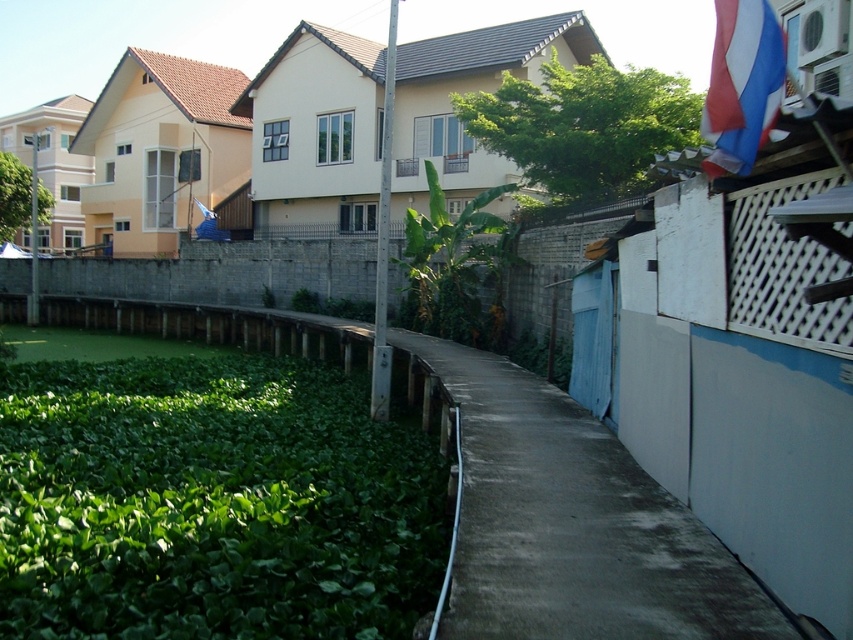
Question: Can you confirm if green grass at lower left is positioned below green leafy vegetation at left?

Choices:
 (A) yes
 (B) no

Answer: (A)

Question: Is green grass at lower left closer to camera compared to green leafy plant at center?

Choices:
 (A) yes
 (B) no

Answer: (A)

Question: Which object appears farthest from the camera in this image?

Choices:
 (A) green grass at lower left
 (B) green leafy plant at center

Answer: (B)

Question: Is green grass at lower left positioned behind red fabric flag at upper right?

Choices:
 (A) yes
 (B) no

Answer: (B)

Question: Which object is the farthest from the green grass at lower left?

Choices:
 (A) green leafy vegetation at left
 (B) green leafy plant at center

Answer: (B)

Question: Which object appears closest to the camera in this image?

Choices:
 (A) green leafy vegetation at left
 (B) green leafy algae at lower left
 (C) red fabric flag at upper right
 (D) green leafy plant at center

Answer: (C)